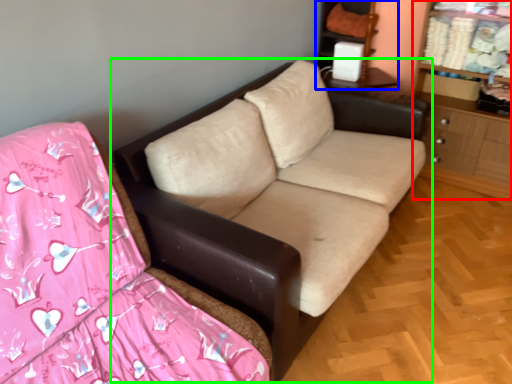
Question: Which object is positioned farthest from dresser (highlighted by a red box)? Select from entertainment center (highlighted by a blue box) and studio couch (highlighted by a green box).

Choices:
 (A) entertainment center
 (B) studio couch

Answer: (B)